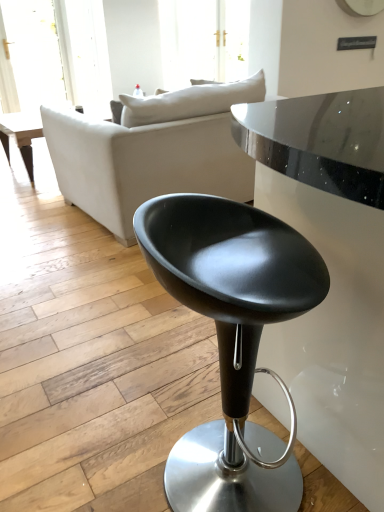
Question: Considering the relative sizes of matte black stool at center and matte white couch at center in the image provided, is matte black stool at center wider than matte white couch at center?

Choices:
 (A) no
 (B) yes

Answer: (A)

Question: Could matte white couch at center be considered to be inside matte black stool at center?

Choices:
 (A) no
 (B) yes

Answer: (A)

Question: From the image's perspective, does matte black stool at center appear lower than matte white couch at center?

Choices:
 (A) yes
 (B) no

Answer: (A)

Question: Can you confirm if matte black stool at center is positioned to the left of matte white couch at center?

Choices:
 (A) yes
 (B) no

Answer: (B)

Question: Is matte black stool at center next to matte white couch at center?

Choices:
 (A) yes
 (B) no

Answer: (B)

Question: From a real-world perspective, does matte black stool at center sit lower than matte white couch at center?

Choices:
 (A) yes
 (B) no

Answer: (A)

Question: Is matte white couch at center beside matte black stool at center?

Choices:
 (A) yes
 (B) no

Answer: (B)

Question: Is the depth of matte white couch at center greater than that of matte black stool at center?

Choices:
 (A) no
 (B) yes

Answer: (B)

Question: Could you tell me if matte white couch at center is facing matte black stool at center?

Choices:
 (A) yes
 (B) no

Answer: (B)

Question: Is matte white couch at center surrounding matte black stool at center?

Choices:
 (A) yes
 (B) no

Answer: (B)

Question: Is matte white couch at center closer to the viewer compared to matte black stool at center?

Choices:
 (A) no
 (B) yes

Answer: (A)

Question: Is matte white couch at center far from matte black stool at center?

Choices:
 (A) no
 (B) yes

Answer: (B)

Question: Is matte white couch at center in front of or behind matte black stool at center in the image?

Choices:
 (A) behind
 (B) front

Answer: (A)